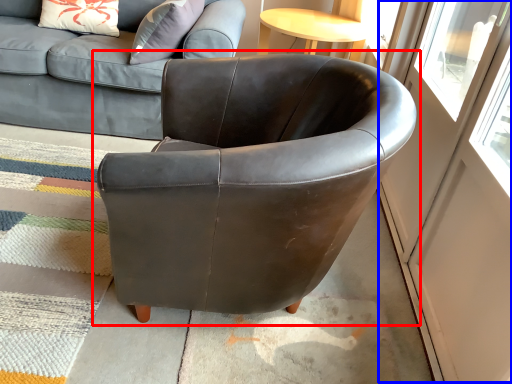
Question: Among these objects, which one is nearest to the camera, chair (highlighted by a red box) or screen door (highlighted by a blue box)?

Choices:
 (A) chair
 (B) screen door

Answer: (B)